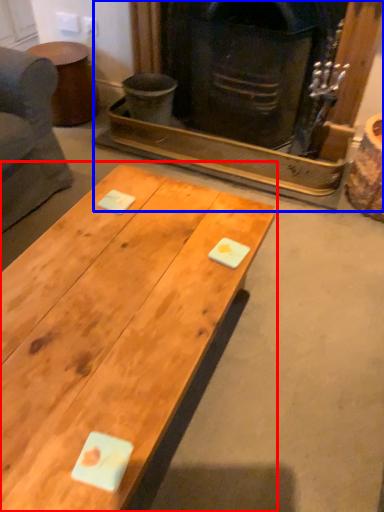
Question: Which point is closer to the camera, coffee table (highlighted by a red box) or fireplace (highlighted by a blue box)?

Choices:
 (A) coffee table
 (B) fireplace

Answer: (A)